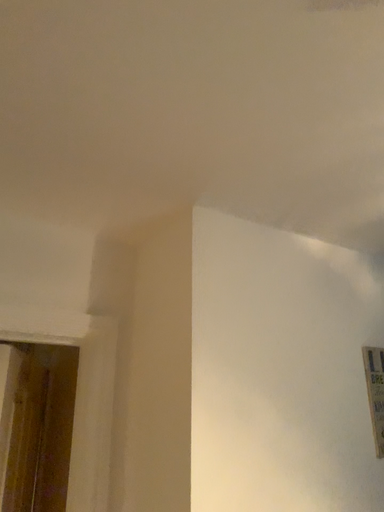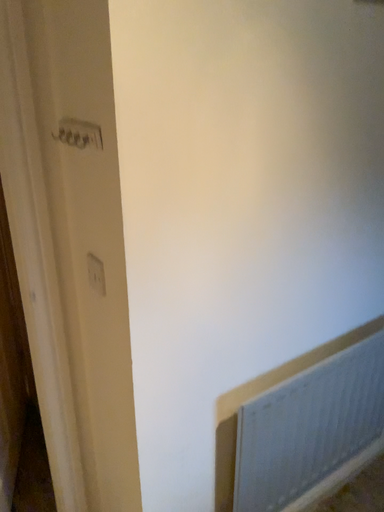
Question: How did the camera likely rotate when shooting the video?

Choices:
 (A) rotated upward
 (B) rotated downward

Answer: (B)